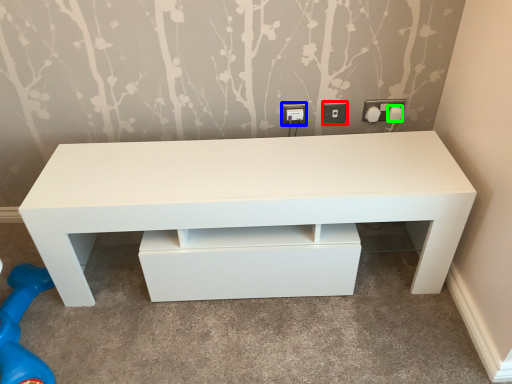
Question: Considering the real-world distances, which object is closest to electric outlet (highlighted by a red box)? electric outlet (highlighted by a blue box) or knob (highlighted by a green box).

Choices:
 (A) electric outlet
 (B) knob

Answer: (A)